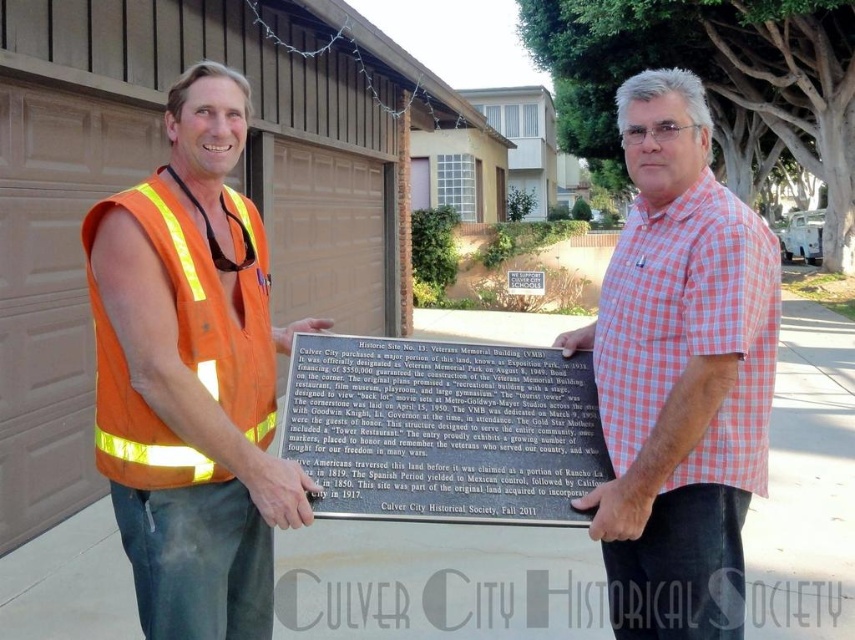
Question: Which point appears closest to the camera in this image?

Choices:
 (A) (258, 403)
 (B) (665, 410)
 (C) (307, 433)
 (D) (186, 611)

Answer: (B)

Question: Which point appears closest to the camera in this image?

Choices:
 (A) (691, 433)
 (B) (186, 154)
 (C) (376, 422)
 (D) (245, 408)

Answer: (A)

Question: Considering the real-world distances, which object is farthest from the black polished stone plaque at center?

Choices:
 (A) hi-visibility orange vest at left
 (B) orange reflective safety vest at left
 (C) pink checkered shirt at center

Answer: (B)

Question: Is the position of hi-visibility orange vest at left less distant than that of pink checkered shirt at center?

Choices:
 (A) yes
 (B) no

Answer: (A)

Question: Does hi-visibility orange vest at left have a larger size compared to black polished stone plaque at center?

Choices:
 (A) yes
 (B) no

Answer: (A)

Question: Does hi-visibility orange vest at left appear on the left side of black polished stone plaque at center?

Choices:
 (A) yes
 (B) no

Answer: (A)